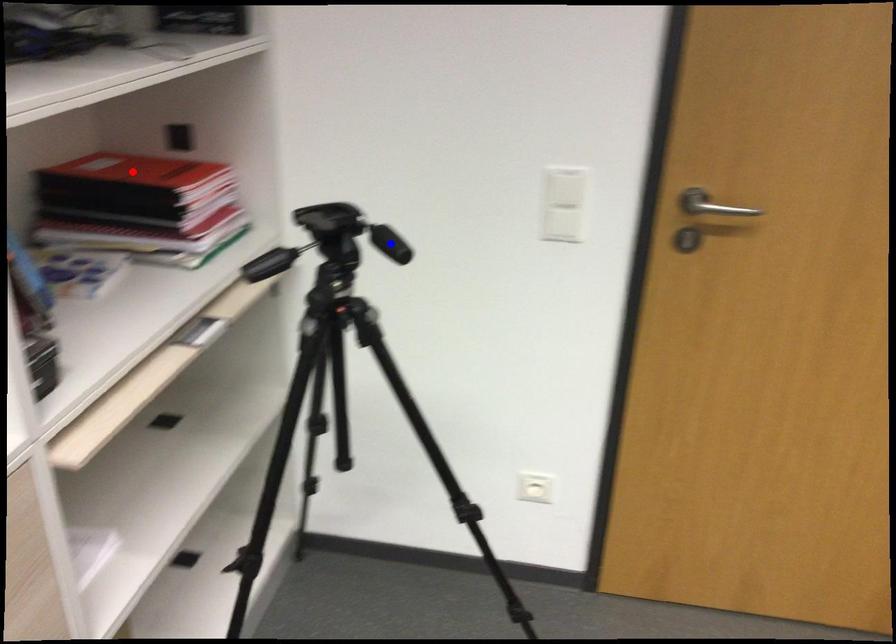
Question: Which of the two points in the image is closer to the camera?

Choices:
 (A) Blue point is closer.
 (B) Red point is closer.

Answer: (A)